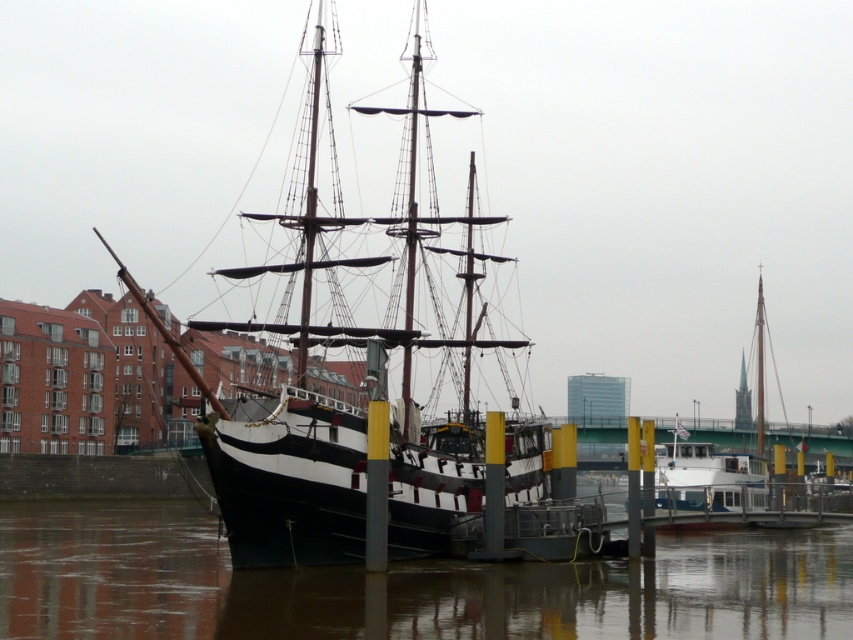
Question: Is black polished wood ship at center further to camera compared to white matte sailboat at right?

Choices:
 (A) no
 (B) yes

Answer: (A)

Question: Which point is closer to the camera taking this photo?

Choices:
 (A) (730, 564)
 (B) (697, 420)

Answer: (A)

Question: From the image, what is the correct spatial relationship of black polished wood ship at center in relation to white matte sailboat at right?

Choices:
 (A) left
 (B) right

Answer: (A)

Question: Is black polished wood ship at center positioned before white matte sailboat at right?

Choices:
 (A) no
 (B) yes

Answer: (B)

Question: Which object is the closest to the white matte sailboat at right?

Choices:
 (A) black polished wood ship at center
 (B) brown water at lower center

Answer: (A)

Question: Estimate the real-world distances between objects in this image. Which object is farther from the brown water at lower center?

Choices:
 (A) white matte sailboat at right
 (B) black polished wood ship at center

Answer: (A)